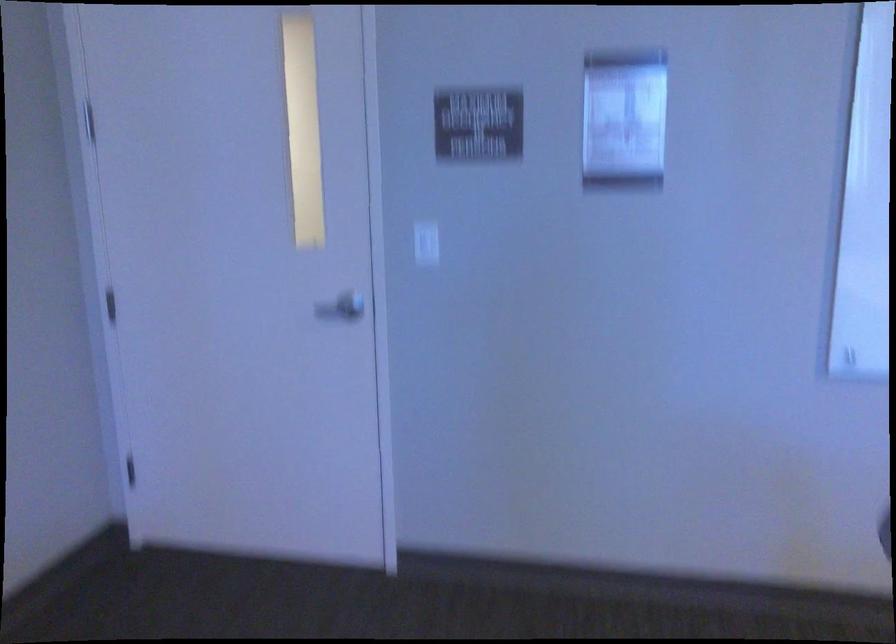
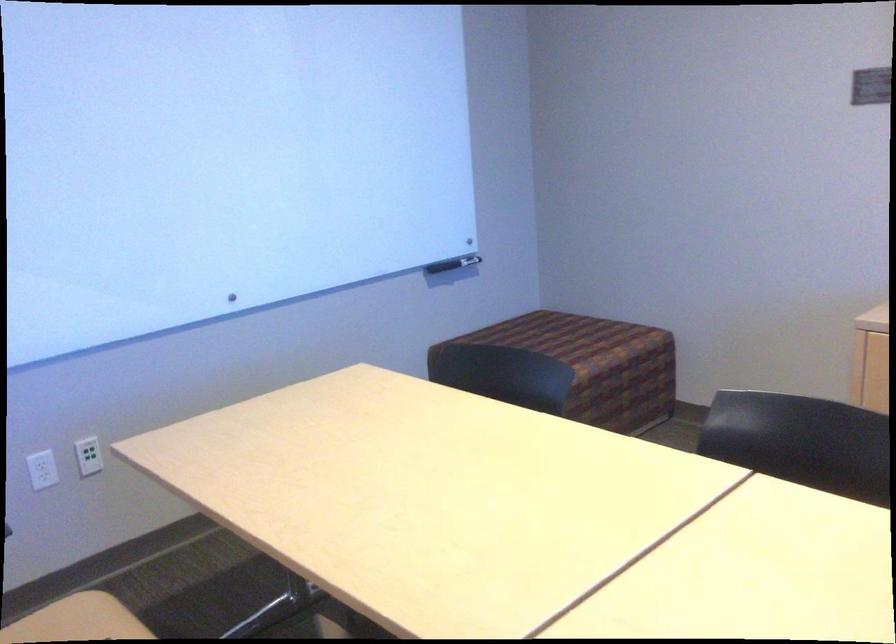
Question: The camera is either moving clockwise (left) or counter-clockwise (right) around the object. The first image is from the beginning of the video and the second image is from the end. Is the camera moving left or right when shooting the video?

Choices:
 (A) Left
 (B) Right

Answer: (A)